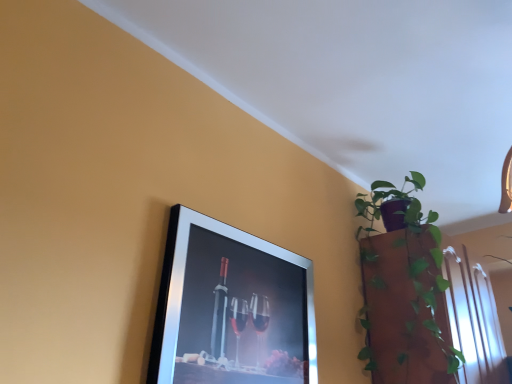
Question: Is silver metallic picture frame at upper left next to green glossy plant at upper right and touching it?

Choices:
 (A) yes
 (B) no

Answer: (B)

Question: From a real-world perspective, is silver metallic picture frame at upper left beneath green glossy plant at upper right?

Choices:
 (A) no
 (B) yes

Answer: (B)

Question: Does silver metallic picture frame at upper left lie behind green glossy plant at upper right?

Choices:
 (A) yes
 (B) no

Answer: (B)

Question: Is silver metallic picture frame at upper left outside of green glossy plant at upper right?

Choices:
 (A) no
 (B) yes

Answer: (B)

Question: From the image's perspective, is silver metallic picture frame at upper left below green glossy plant at upper right?

Choices:
 (A) no
 (B) yes

Answer: (B)

Question: Is silver metallic picture frame at upper left surrounding green glossy plant at upper right?

Choices:
 (A) no
 (B) yes

Answer: (A)

Question: Is green glossy plant at upper right in front of silver metallic picture frame at upper left?

Choices:
 (A) no
 (B) yes

Answer: (A)

Question: Is green glossy plant at upper right not inside silver metallic picture frame at upper left?

Choices:
 (A) yes
 (B) no

Answer: (A)

Question: Is green glossy plant at upper right taller than silver metallic picture frame at upper left?

Choices:
 (A) no
 (B) yes

Answer: (B)

Question: From the image's perspective, would you say green glossy plant at upper right is shown under silver metallic picture frame at upper left?

Choices:
 (A) no
 (B) yes

Answer: (A)

Question: From a real-world perspective, is green glossy plant at upper right positioned under silver metallic picture frame at upper left based on gravity?

Choices:
 (A) yes
 (B) no

Answer: (B)

Question: Considering the relative positions of green glossy plant at upper right and silver metallic picture frame at upper left in the image provided, is green glossy plant at upper right to the left of silver metallic picture frame at upper left from the viewer's perspective?

Choices:
 (A) no
 (B) yes

Answer: (A)

Question: Which is correct: green glossy plant at upper right is inside silver metallic picture frame at upper left, or outside of it?

Choices:
 (A) inside
 (B) outside

Answer: (B)